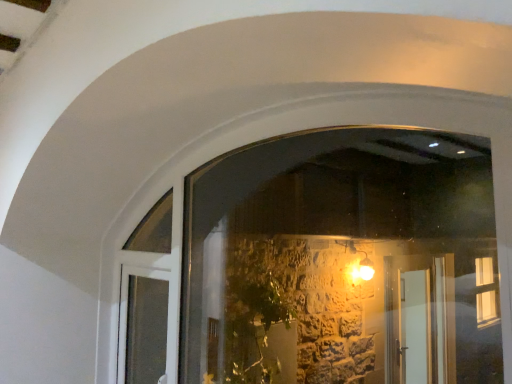
Describe the element at coordinates (142, 326) in the screenshot. This screenshot has height=384, width=512. I see `white glossy door at lower left` at that location.

Looking at this image, what is the approximate height of white glossy door at lower left?

58.72 centimeters.

I want to click on white glossy door at lower left, so click(142, 326).

What do you see at coordinates (343, 262) in the screenshot? I see `transparent glass window at center` at bounding box center [343, 262].

Image resolution: width=512 pixels, height=384 pixels. I want to click on transparent glass window at center, so click(343, 262).

This screenshot has height=384, width=512. What are the coordinates of `white glossy door at lower left` in the screenshot? It's located at (142, 326).

Considering the positions of objects white glossy door at lower left and transparent glass window at center in the image provided, who is more to the left, white glossy door at lower left or transparent glass window at center?

white glossy door at lower left.

Is the position of white glossy door at lower left less distant than that of transparent glass window at center?

No, it is not.

Is point (120, 344) farther from camera compared to point (205, 201)?

No, (120, 344) is in front of (205, 201).

From the image's perspective, relative to transparent glass window at center, is white glossy door at lower left above or below?

Based on their image positions, white glossy door at lower left is located beneath transparent glass window at center.

From a real-world perspective, which object rests below the other?

From a 3D spatial view, white glossy door at lower left is below.

Considering the sizes of objects white glossy door at lower left and transparent glass window at center in the image provided, who is wider, white glossy door at lower left or transparent glass window at center?

white glossy door at lower left.

Considering the sizes of objects white glossy door at lower left and transparent glass window at center in the image provided, who is taller, white glossy door at lower left or transparent glass window at center?

transparent glass window at center is taller.

Which of these two, white glossy door at lower left or transparent glass window at center, is bigger?

transparent glass window at center.

Is white glossy door at lower left completely or partially outside of transparent glass window at center?

No, white glossy door at lower left is inside or overlapping with transparent glass window at center.

Is white glossy door at lower left with transparent glass window at center?

No, white glossy door at lower left is not in contact with transparent glass window at center.

Does white glossy door at lower left turn towards transparent glass window at center?

Yes, white glossy door at lower left is oriented towards transparent glass window at center.

How different are the orientations of white glossy door at lower left and transparent glass window at center in degrees?

0.014 degrees.

How much distance is there between white glossy door at lower left and transparent glass window at center?

white glossy door at lower left is 1.34 meters from transparent glass window at center.

What are the coordinates of `door behind the transparent glass window at center` in the screenshot? It's located at (142, 326).

Based on the photo, which object is positioned more to the right, transparent glass window at center or white glossy door at lower left?

From the viewer's perspective, transparent glass window at center appears more on the right side.

Between transparent glass window at center and white glossy door at lower left, which one is positioned behind?

white glossy door at lower left is behind.

From the picture: Which is closer, (286, 262) or (160, 344)?

Positioned in front is point (160, 344).

From the image's perspective, which is below, transparent glass window at center or white glossy door at lower left?

white glossy door at lower left, from the image's perspective.

Based on the photo, from a real-world perspective, which object rests below the other?

From a 3D spatial view, white glossy door at lower left is below.

Does transparent glass window at center have a lesser width compared to white glossy door at lower left?

Indeed, transparent glass window at center has a lesser width compared to white glossy door at lower left.

Which of these two, transparent glass window at center or white glossy door at lower left, stands shorter?

Standing shorter between the two is white glossy door at lower left.

Considering the relative sizes of transparent glass window at center and white glossy door at lower left in the image provided, is transparent glass window at center bigger than white glossy door at lower left?

Indeed, transparent glass window at center has a larger size compared to white glossy door at lower left.

Is transparent glass window at center not inside white glossy door at lower left?

Yes, transparent glass window at center is outside of white glossy door at lower left.

Is the surface of transparent glass window at center in direct contact with white glossy door at lower left?

No, transparent glass window at center is not touching white glossy door at lower left.

Is white glossy door at lower left at the back of transparent glass window at center?

Yes, transparent glass window at center's orientation is away from white glossy door at lower left.

Find the location of a particular element. This screenshot has height=384, width=512. door behind the transparent glass window at center is located at coordinates (142, 326).

Identify the location of door that appears on the left of transparent glass window at center. (142, 326).

Locate an element on the screen. window above the white glossy door at lower left (from a real-world perspective) is located at coordinates (343, 262).